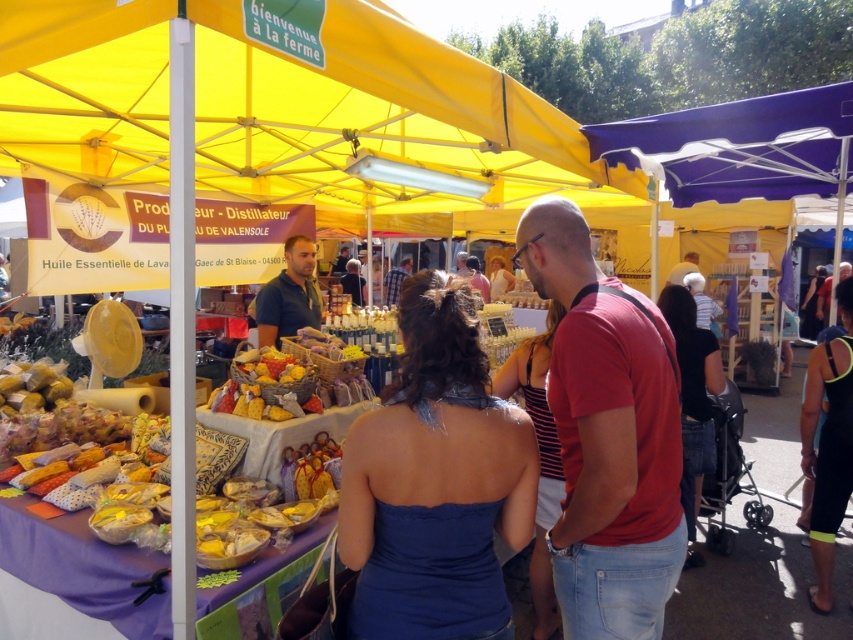
Question: Estimate the real-world distances between objects in this image. Which object is farther from the red cotton t-shirt at center?

Choices:
 (A) neon yellow fabric at lower right
 (B) matte white shirt at center
 (C) light brown leather jacket at center

Answer: (B)

Question: Does blue satin dress at center appear over red cotton t-shirt at center?

Choices:
 (A) yes
 (B) no

Answer: (B)

Question: Which object appears closest to the camera in this image?

Choices:
 (A) blue satin dress at center
 (B) matte white shirt at center

Answer: (A)

Question: Is black denim jeans at lower right positioned at the back of matte blue shirt at center?

Choices:
 (A) no
 (B) yes

Answer: (A)

Question: Among these objects, which one is nearest to the camera?

Choices:
 (A) light brown leather jacket at center
 (B) bright yellow fabric at center
 (C) neon yellow fabric at lower right

Answer: (B)

Question: Does neon yellow fabric at lower right have a smaller size compared to light brown leather jacket at center?

Choices:
 (A) yes
 (B) no

Answer: (A)